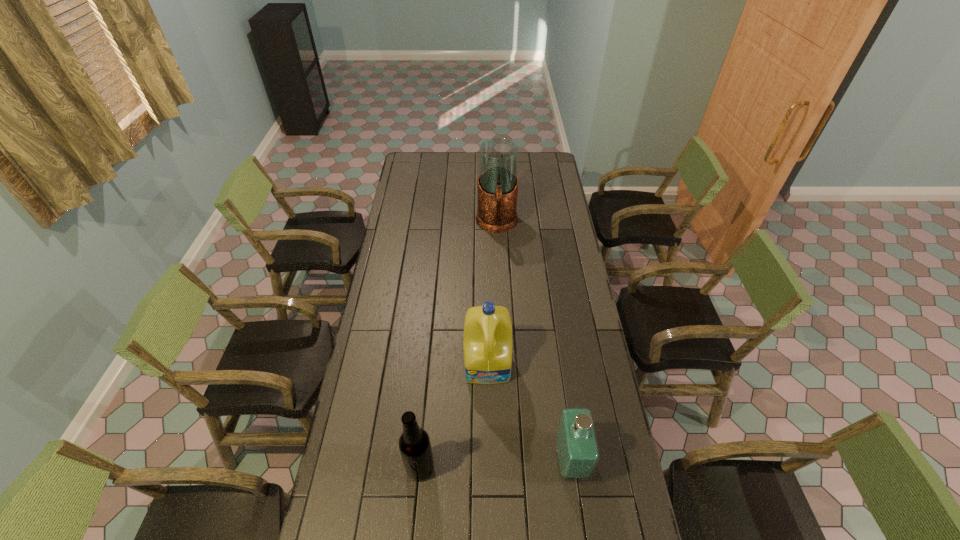
Identify which object is the third closest to the beer bottle. Please provide its 2D coordinates. Your answer should be formatted as a tuple, i.e. [(x, y)], where the tuple contains the x and y coordinates of a point satisfying the conditions above.

[(498, 157)]

Identify which object is the nearest to the detergent. Please provide its 2D coordinates. Your answer should be formatted as a tuple, i.e. [(x, y)], where the tuple contains the x and y coordinates of a point satisfying the conditions above.

[(577, 453)]

This screenshot has height=540, width=960. Find the location of `vacant point that satisfies the following two spatial constraints: 1. on the front side of the second farthest object; 2. on the front label of the shortest object`. vacant point that satisfies the following two spatial constraints: 1. on the front side of the second farthest object; 2. on the front label of the shortest object is located at coordinates (490, 461).

Where is `free space that satisfies the following two spatial constraints: 1. on the back side of the third nearest object; 2. on the left side of the pitcher`? free space that satisfies the following two spatial constraints: 1. on the back side of the third nearest object; 2. on the left side of the pitcher is located at coordinates (487, 224).

Where is `vacant space that satisfies the following two spatial constraints: 1. on the front side of the third nearest object; 2. on the front label of the shortest object`? The height and width of the screenshot is (540, 960). vacant space that satisfies the following two spatial constraints: 1. on the front side of the third nearest object; 2. on the front label of the shortest object is located at coordinates (490, 461).